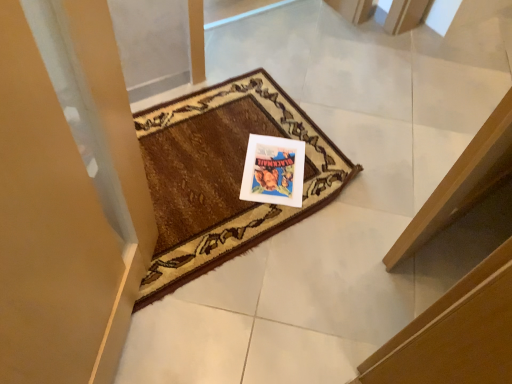
The image size is (512, 384). In order to click on free space above white glossy picture frame at center (from a real-world perspective) in this screenshot , I will do pos(273,161).